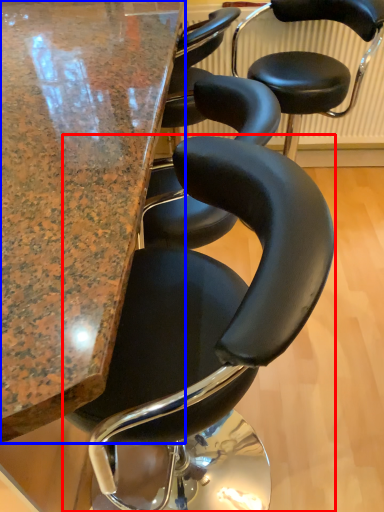
Question: Which point is closer to the camera, chair (highlighted by a red box) or table (highlighted by a blue box)?

Choices:
 (A) chair
 (B) table

Answer: (B)